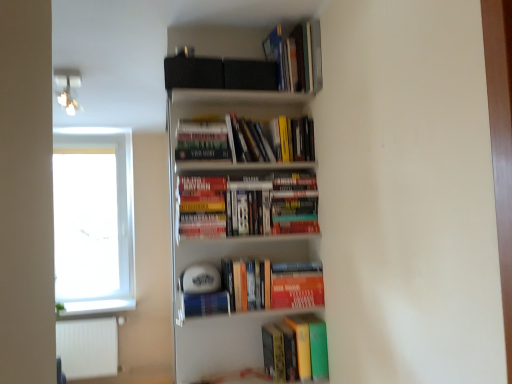
Question: In which direction should I rotate to look at hardcover books at upper center, the first book when ordered from top to bottom?

Choices:
 (A) left
 (B) right

Answer: (B)

Question: Does hardcover books at upper center, which appears as the fourth book when ordered from the bottom, have a larger size compared to white matte radiator at lower left?

Choices:
 (A) yes
 (B) no

Answer: (B)

Question: Is hardcover books at upper center, the first book when ordered from top to bottom, thinner than white matte radiator at lower left?

Choices:
 (A) no
 (B) yes

Answer: (A)

Question: From a real-world perspective, is hardcover books at upper center, which appears as the fourth book when ordered from the bottom, physically below white matte radiator at lower left?

Choices:
 (A) no
 (B) yes

Answer: (A)

Question: Can you confirm if hardcover books at upper center, which appears as the fourth book when ordered from the bottom, is smaller than white matte radiator at lower left?

Choices:
 (A) yes
 (B) no

Answer: (A)

Question: From the image's perspective, does hardcover books at upper center, the first book when ordered from top to bottom, appear higher than white matte radiator at lower left?

Choices:
 (A) no
 (B) yes

Answer: (B)

Question: From a real-world perspective, is hardcover books at upper center, the first book when ordered from top to bottom, over white matte radiator at lower left?

Choices:
 (A) no
 (B) yes

Answer: (B)

Question: Is hardcover books at upper center, arranged as the 2th book when viewed from the top, at the right side of orange matte paperback book at center?

Choices:
 (A) yes
 (B) no

Answer: (B)

Question: From a real-world perspective, is hardcover books at upper center, which ranks as the 3th book in bottom-to-top order, beneath orange matte paperback book at center?

Choices:
 (A) no
 (B) yes

Answer: (A)

Question: Is hardcover books at upper center, which ranks as the 3th book in bottom-to-top order, further to camera compared to orange matte paperback book at center?

Choices:
 (A) yes
 (B) no

Answer: (B)

Question: Is hardcover books at upper center, arranged as the 2th book when viewed from the top, with orange matte paperback book at center?

Choices:
 (A) yes
 (B) no

Answer: (B)

Question: Considering the relative sizes of hardcover books at upper center, which ranks as the 3th book in bottom-to-top order, and orange matte paperback book at center in the image provided, is hardcover books at upper center, which ranks as the 3th book in bottom-to-top order, taller than orange matte paperback book at center?

Choices:
 (A) no
 (B) yes

Answer: (B)

Question: From a real-world perspective, is hardcover books at upper center, arranged as the 2th book when viewed from the top, over orange matte paperback book at center?

Choices:
 (A) yes
 (B) no

Answer: (A)

Question: From a real-world perspective, does white glass window at left sit lower than orange matte paperback book at center?

Choices:
 (A) yes
 (B) no

Answer: (B)